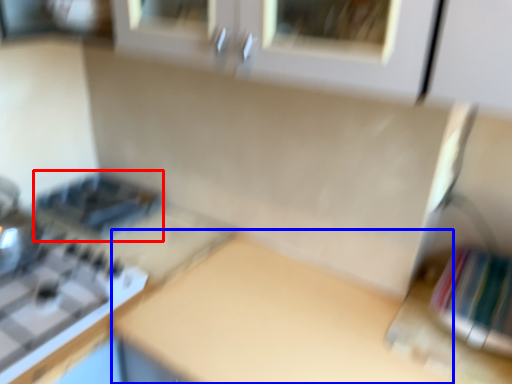
Question: Which point is closer to the camera, appliance (highlighted by a red box) or counter top (highlighted by a blue box)?

Choices:
 (A) appliance
 (B) counter top

Answer: (B)